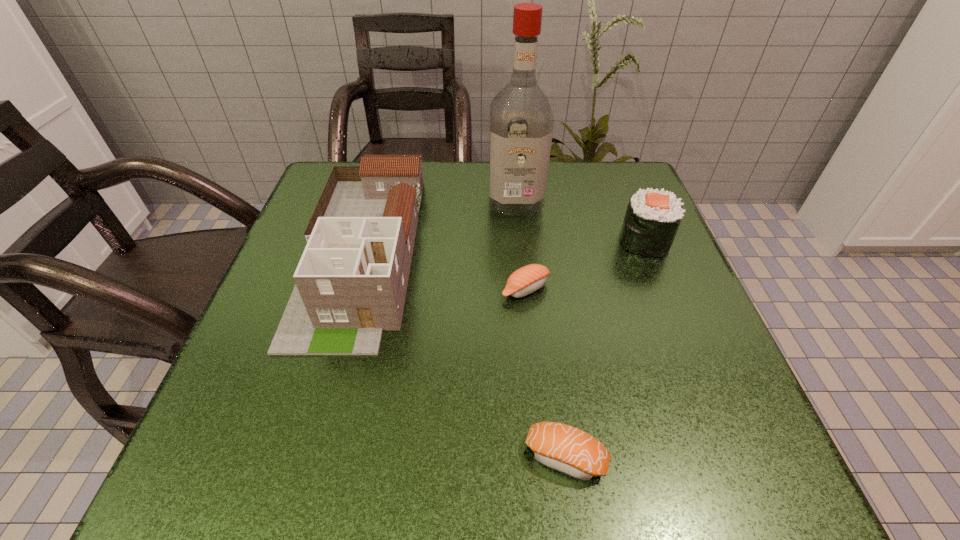
Locate an element on the screen. liquor is located at coordinates (521, 121).

The width and height of the screenshot is (960, 540). I want to click on dollhouse, so click(x=351, y=281).

The image size is (960, 540). What are the coordinates of `the leftmost object` in the screenshot? It's located at (351, 281).

Locate an element on the screen. This screenshot has width=960, height=540. the rightmost object is located at coordinates (652, 219).

Locate an element on the screen. The height and width of the screenshot is (540, 960). the rightmost sushi is located at coordinates (652, 219).

Locate an element on the screen. the second nearest sushi is located at coordinates (526, 280).

Where is `the nearest object`? This screenshot has width=960, height=540. the nearest object is located at coordinates (564, 448).

Find the location of a particular element. vacant space located 0.340m on the front-facing side of the liquor is located at coordinates (528, 338).

I want to click on free space located at the main entrance of the leftmost object, so click(316, 416).

I want to click on vacant space located on the front of the third tallest object, so click(721, 428).